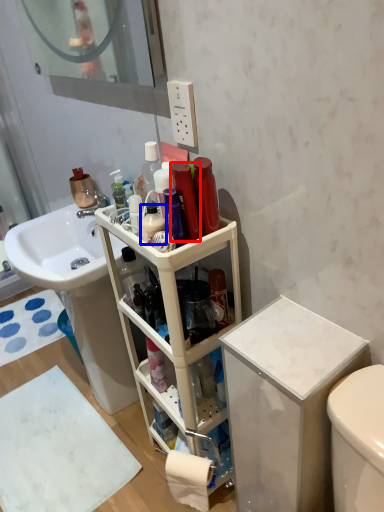
Question: Which point is closer to the camera, toiletry (highlighted by a red box) or cleaning product (highlighted by a blue box)?

Choices:
 (A) toiletry
 (B) cleaning product

Answer: (A)